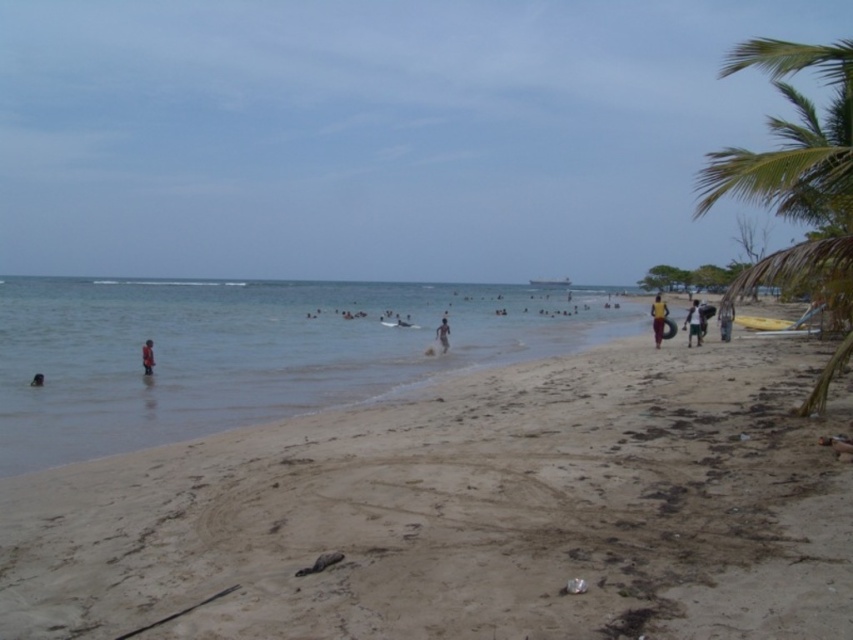
You are standing on the beach and want to take a photo of the dark skin human at lower left without the green leafy palm tree at right blocking the view. Is this possible?

The green leafy palm tree at right is in front of the dark skin human at lower left, so it would block the view. To avoid the palm tree blocking the view, you would need to move to a position where the palm tree is not between you and the human.

You are planning to set up a picnic blanket on the beach. The picnic blanket is 2 meters wide. You have two options for placement on the brown sandy beach at lower left and the light brown sand at center. Based on the scene, which area can accommodate the blanket without folding it?

The brown sandy beach at lower left has a greater width than the light brown sand at center, so the picnic blanket can be placed on the brown sandy beach at lower left without folding it.